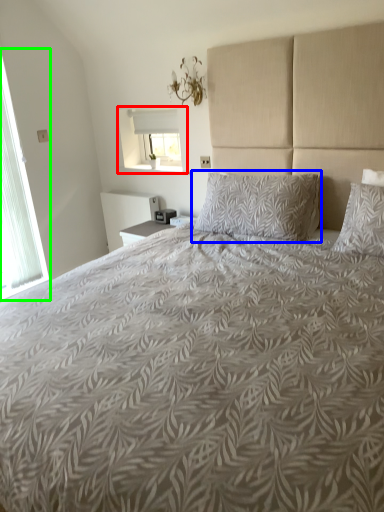
Question: Which is farther away from window (highlighted by a red box)? pillow (highlighted by a blue box) or window (highlighted by a green box)?

Choices:
 (A) pillow
 (B) window

Answer: (A)